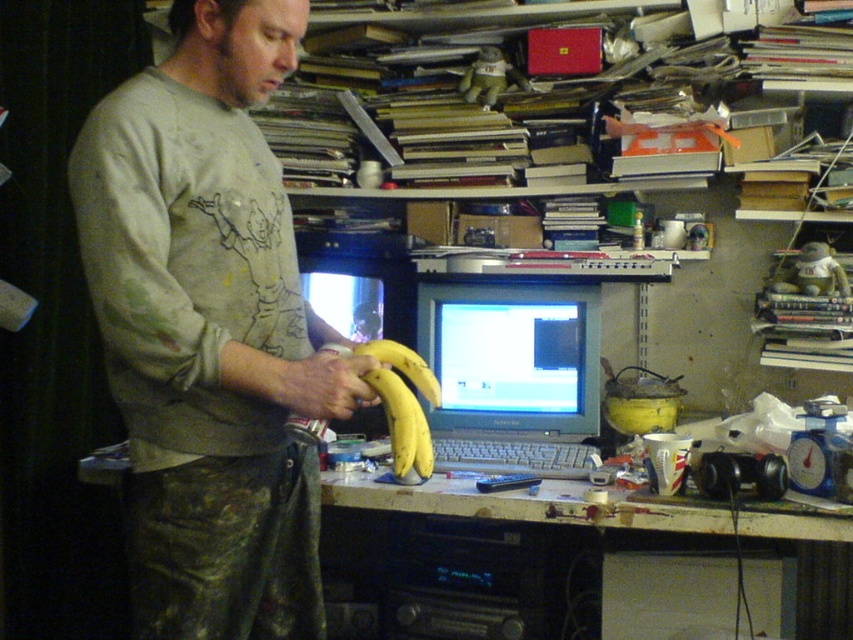
Which is more to the right, white plastic computer desk at center or yellow matte bananas at center?

white plastic computer desk at center

How far apart are white plastic computer desk at center and yellow matte bananas at center?

They are 14.19 inches apart.

Where is `white plastic computer desk at center`? The image size is (853, 640). white plastic computer desk at center is located at coordinates (531, 502).

Does yellow matte bananas at center appear on the right side of yellow matte banana at center?

Correct, you'll find yellow matte bananas at center to the right of yellow matte banana at center.

Looking at this image, does yellow matte bananas at center have a lesser width compared to yellow matte banana at center?

No.

The height and width of the screenshot is (640, 853). What do you see at coordinates (402, 403) in the screenshot?
I see `yellow matte bananas at center` at bounding box center [402, 403].

At what (x,y) coordinates should I click in order to perform the action: click on yellow matte bananas at center. Please return your answer as a coordinate pair (x, y). The height and width of the screenshot is (640, 853). Looking at the image, I should click on (402, 403).

Is light gray sweatshirt at center positioned in front of yellow matte bananas at center?

Yes, it is in front of yellow matte bananas at center.

Is point (248, 273) positioned in front of point (419, 461)?

Yes.

Which is behind, point (132, 413) or point (404, 480)?

Point (404, 480)

Locate an element on the screen. This screenshot has width=853, height=640. light gray sweatshirt at center is located at coordinates (204, 328).